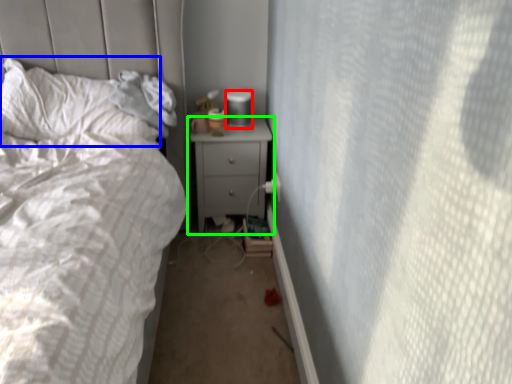
Question: Which is nearer to the gray (highlighted by a red box)? pillow (highlighted by a blue box) or nightstand (highlighted by a green box).

Choices:
 (A) pillow
 (B) nightstand

Answer: (B)